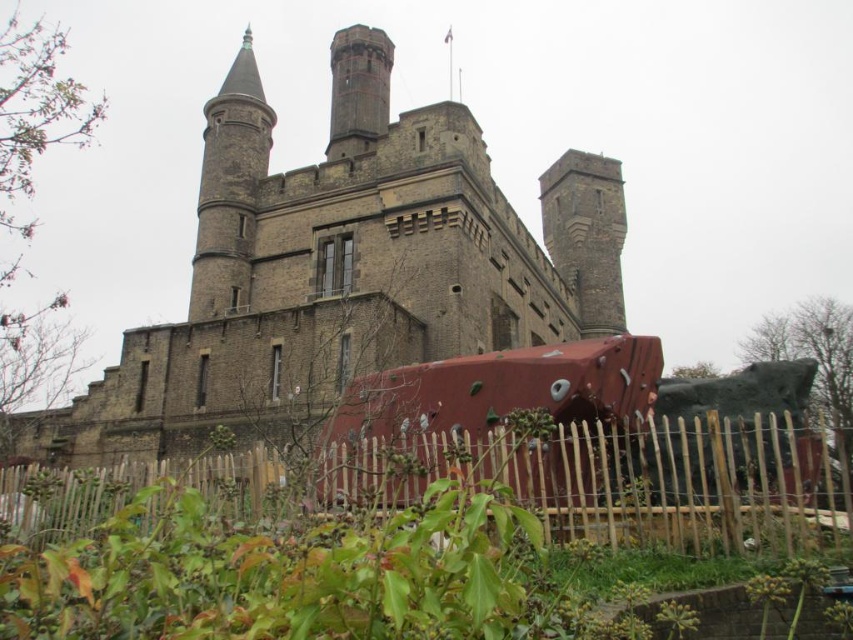
Who is taller, gray stone tower at upper center or dark gray stone tower at upper center?

gray stone tower at upper center is taller.

Which is above, gray stone tower at upper center or dark gray stone tower at upper center?

dark gray stone tower at upper center is higher up.

Which is behind, point (585, 280) or point (364, 88)?

The point (585, 280) is behind.

At what (x,y) coordinates should I click in order to perform the action: click on gray stone tower at upper center. Please return your answer as a coordinate pair (x, y). The height and width of the screenshot is (640, 853). Looking at the image, I should click on (585, 236).

Is rustic metal train car at center further to the viewer compared to dark gray stone tower at upper center?

No, it is in front of dark gray stone tower at upper center.

Does rustic metal train car at center have a greater height compared to dark gray stone tower at upper center?

No, rustic metal train car at center is not taller than dark gray stone tower at upper center.

You are a GUI agent. You are given a task and a screenshot of the screen. Output one action in this format:
    pyautogui.click(x=<x>, y=<y>)
    Task: Click on the rustic metal train car at center
    The height and width of the screenshot is (640, 853).
    Given the screenshot: What is the action you would take?
    pyautogui.click(x=490, y=417)

Locate an element on the screen. The height and width of the screenshot is (640, 853). rustic metal train car at center is located at coordinates (490, 417).

This screenshot has width=853, height=640. What do you see at coordinates (627, 481) in the screenshot?
I see `wooden picket fence at lower center` at bounding box center [627, 481].

Who is more forward, [700,468] or [339,97]?

Point [700,468]

Is point (363, 486) closer to viewer compared to point (343, 83)?

Yes, it is in front of point (343, 83).

Where is `wooden picket fence at lower center`? wooden picket fence at lower center is located at coordinates (627, 481).